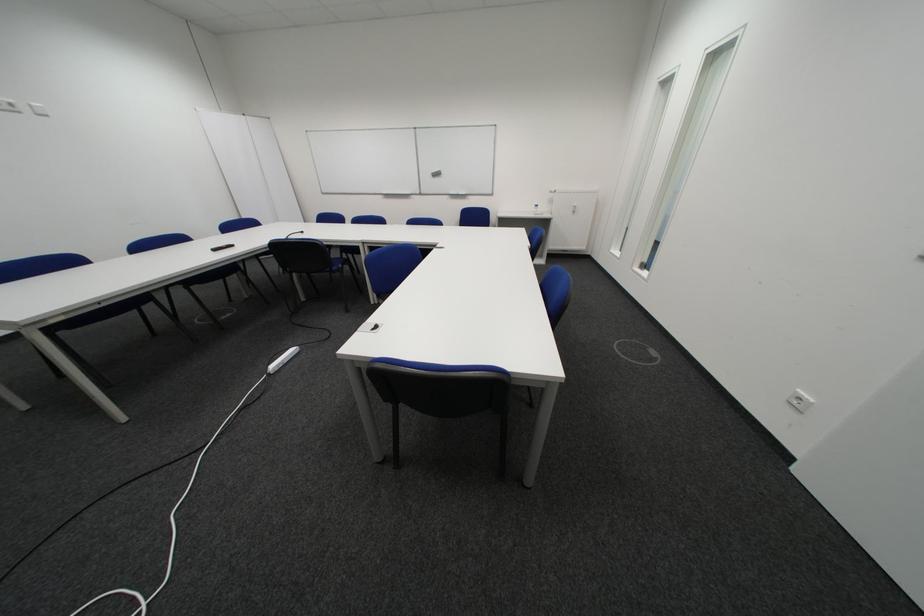
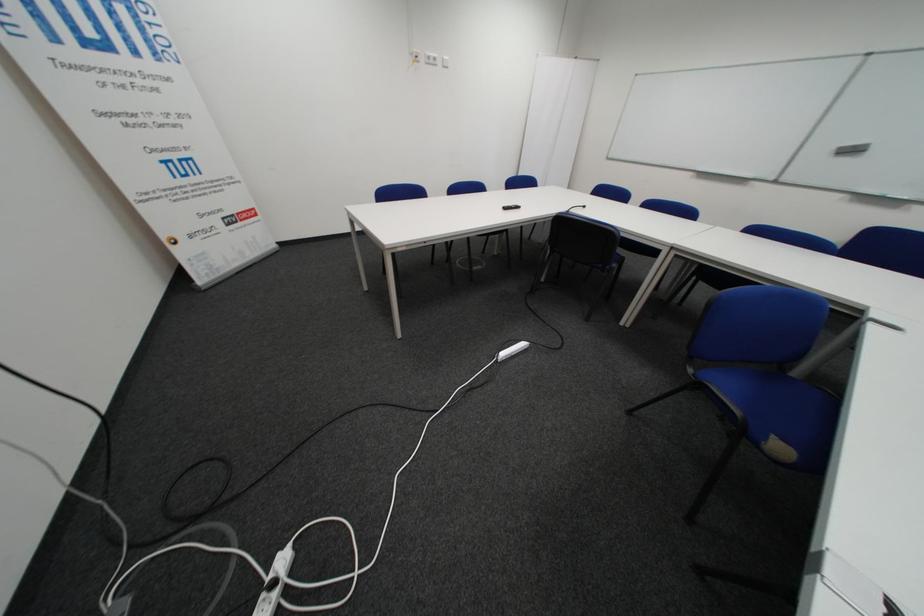
Question: The camera is either moving clockwise (left) or counter-clockwise (right) around the object. The first image is from the beginning of the video and the second image is from the end. Is the camera moving left or right when shooting the video?

Choices:
 (A) Left
 (B) Right

Answer: (B)